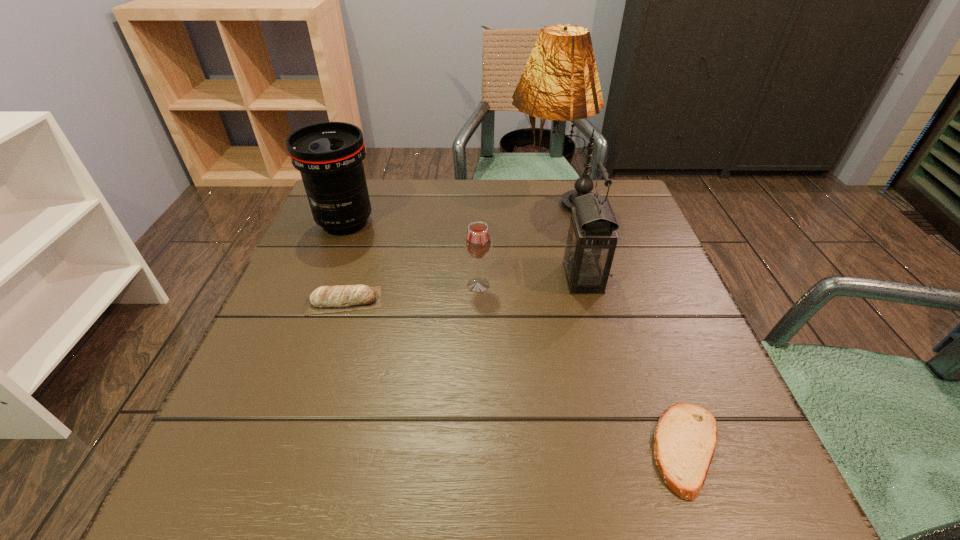
Find the location of `lampshade`. lampshade is located at coordinates (560, 81).

Identify the location of lantern. This screenshot has width=960, height=540. 591,239.

Locate an element on the screen. telephoto lens is located at coordinates (329, 155).

I want to click on the third object from left to right, so click(478, 242).

Identify the location of the third shortest object. Image resolution: width=960 pixels, height=540 pixels. click(x=478, y=242).

Find the location of `the taller pita bread`. the taller pita bread is located at coordinates (326, 299).

In order to click on the second shortest object in this screenshot , I will do `click(326, 299)`.

At what (x,y) coordinates should I click in order to perform the action: click on the nearer pita bread. Please return your answer as a coordinate pair (x, y). Looking at the image, I should click on (685, 437).

Locate an element on the screen. the right pita bread is located at coordinates (685, 437).

Locate an element on the screen. The image size is (960, 540). vacant region located 0.300m on the front-facing side of the lampshade is located at coordinates (396, 200).